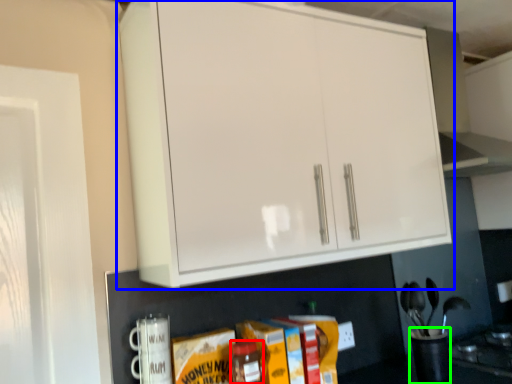
Question: Which object is the closest to the bottle (highlighted by a red box)? Choose among these: cabinetry (highlighted by a blue box) or appliance (highlighted by a green box).

Choices:
 (A) cabinetry
 (B) appliance

Answer: (B)